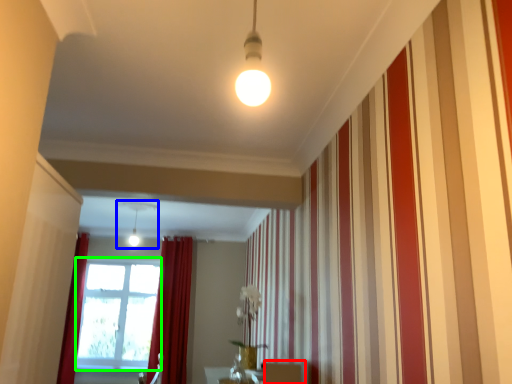
Question: Estimate the real-world distances between objects in this image. Which object is closer to furniture (highlighted by a red box), light fixture (highlighted by a blue box) or window screen (highlighted by a green box)?

Choices:
 (A) light fixture
 (B) window screen

Answer: (A)